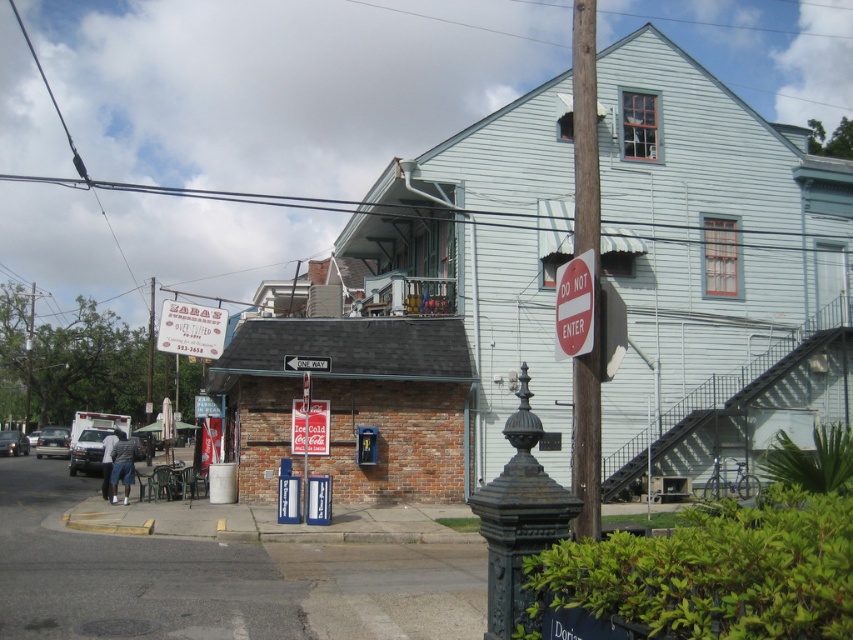
Which is in front, point (590, 452) or point (15, 442)?

Point (590, 452)

Is wooden pole at center taller than matte black car at lower left?

Yes, wooden pole at center is taller than matte black car at lower left.

Locate an element on the screen. wooden pole at center is located at coordinates (595, 269).

Locate an element on the screen. Image resolution: width=853 pixels, height=640 pixels. wooden pole at center is located at coordinates [595, 269].

Is the position of white paper sign at center more distant than that of metallic silver sign at center?

Yes, it is behind metallic silver sign at center.

Can you confirm if white paper sign at center is positioned above metallic silver sign at center?

Correct, white paper sign at center is located above metallic silver sign at center.

Which is in front, point (161, 321) or point (312, 413)?

Point (312, 413) is more forward.

Image resolution: width=853 pixels, height=640 pixels. Find the location of `white paper sign at center`. white paper sign at center is located at coordinates (190, 330).

Is red plastic sign at upper right bigger than matte white van at lower left?

No.

Is red plastic sign at upper right thinner than matte white van at lower left?

Yes, red plastic sign at upper right is thinner than matte white van at lower left.

Where is `red plastic sign at upper right`? Image resolution: width=853 pixels, height=640 pixels. red plastic sign at upper right is located at coordinates (573, 307).